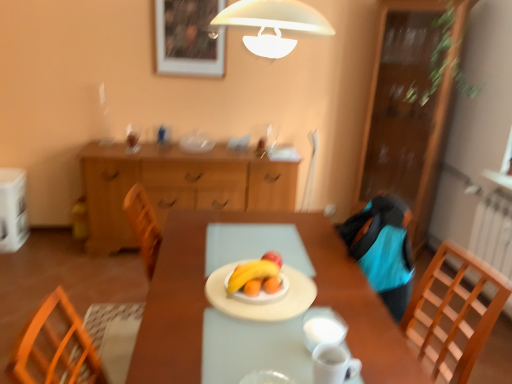
The height and width of the screenshot is (384, 512). Find the location of `vacant position to the left of shiny red apple at center`. vacant position to the left of shiny red apple at center is located at coordinates (208, 263).